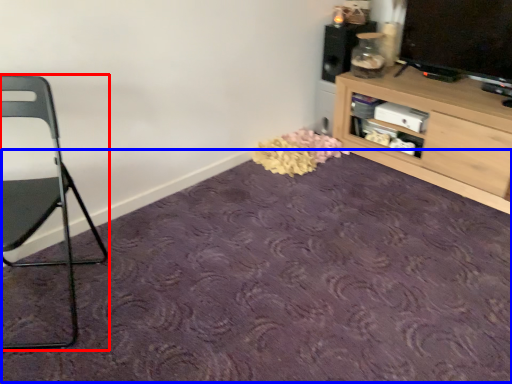
Question: Which object is further to the camera taking this photo, chair (highlighted by a red box) or plain (highlighted by a blue box)?

Choices:
 (A) chair
 (B) plain

Answer: (A)